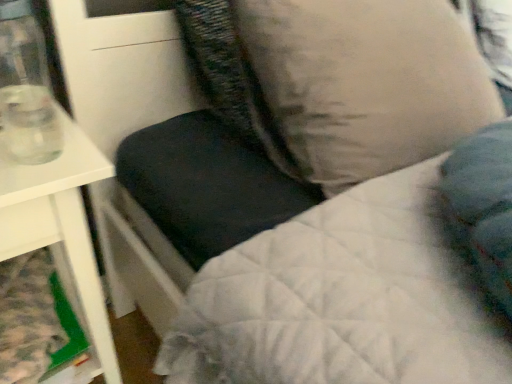
At what (x,y) coordinates should I click in order to perform the action: click on free space to the back side of transparent glass at left. Please return your answer as a coordinate pair (x, y). The width and height of the screenshot is (512, 384). Looking at the image, I should click on (51, 122).